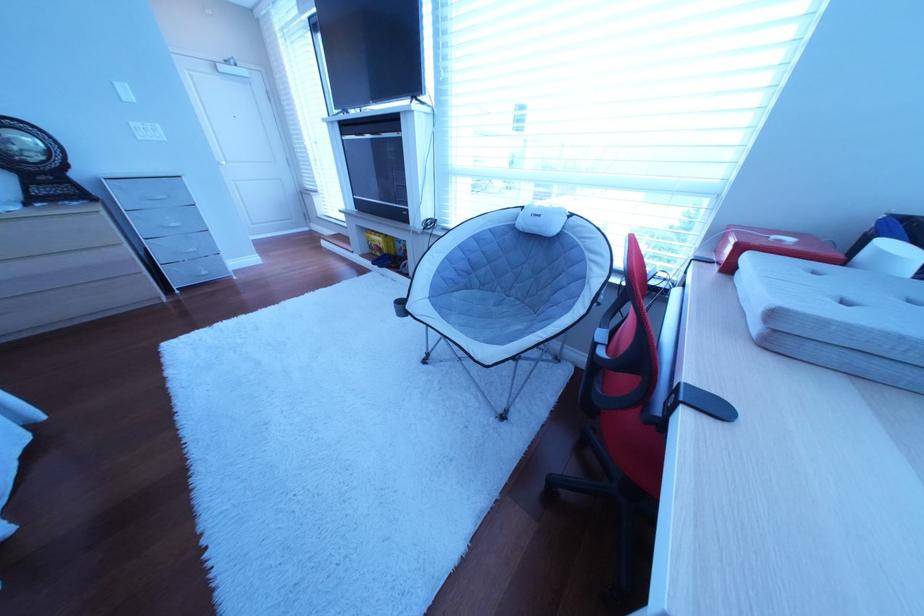
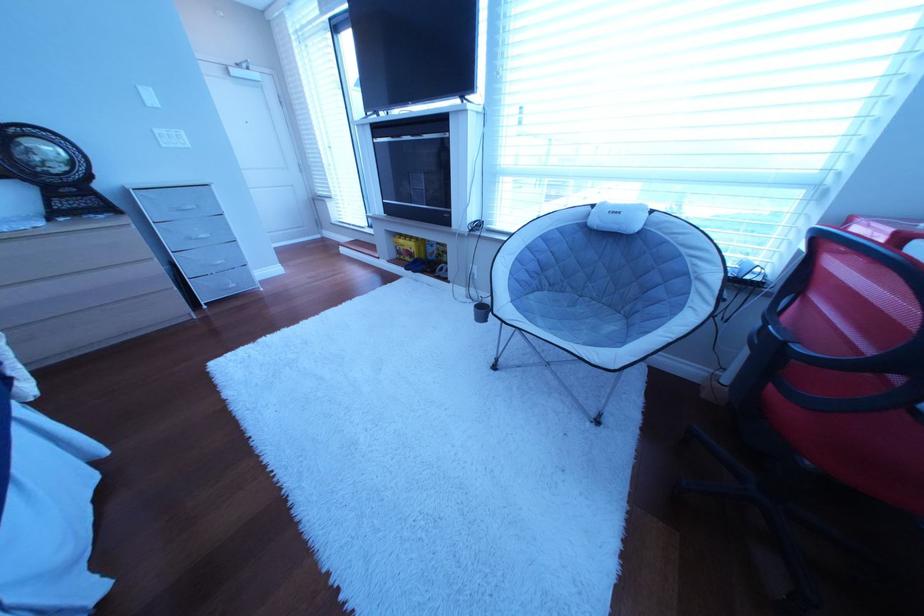
Where in the second image is the point corresponding to point (495, 292) from the first image?

(565, 293)